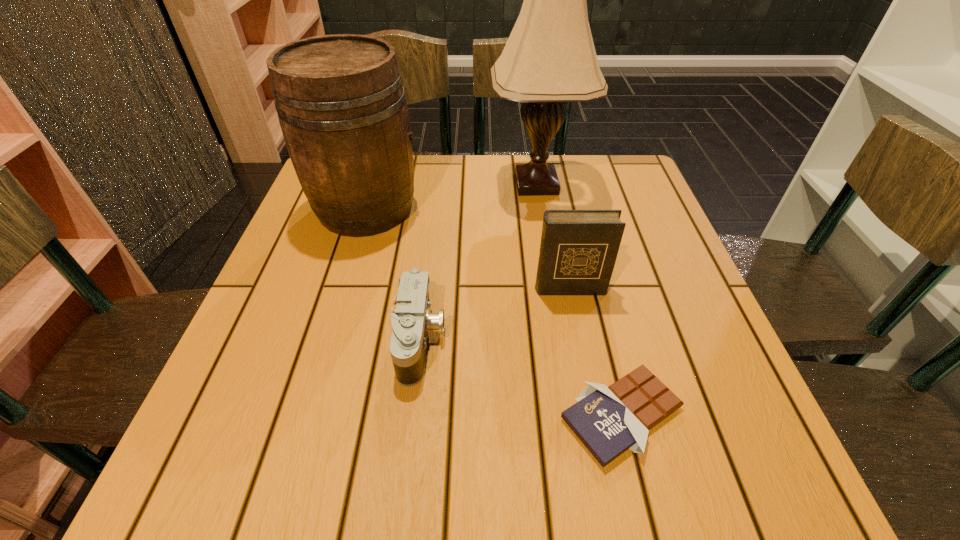
In order to click on free space that satisfies the following two spatial constraints: 1. on the front cover of the chocolate bar; 2. on the right side of the third nearest object in this screenshot , I will do `click(594, 415)`.